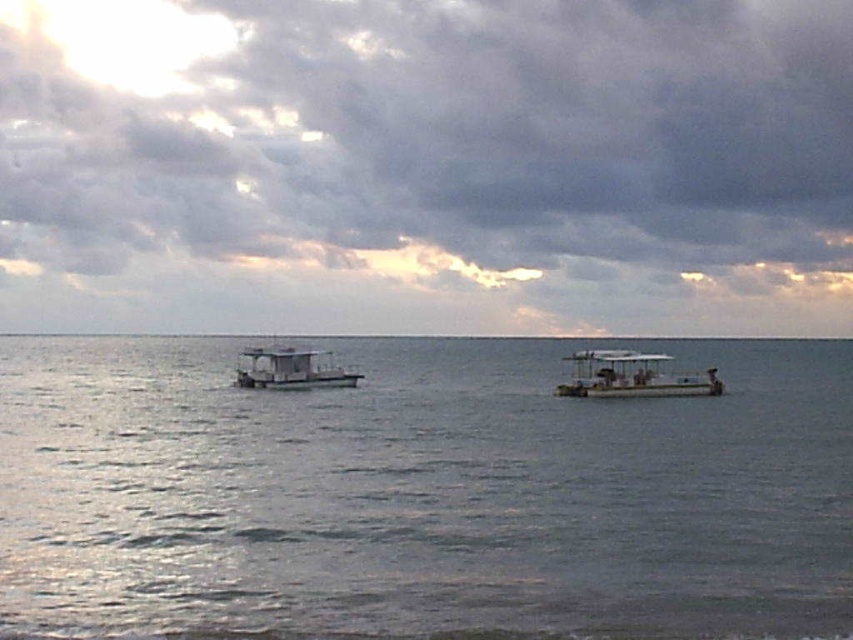
Question: Among these objects, which one is nearest to the camera?

Choices:
 (A) metallic gray boat at right
 (B) cloudy sky at upper center
 (C) white matte boat at center
 (D) clear water at center

Answer: (D)

Question: Does cloudy sky at upper center have a smaller size compared to white matte boat at center?

Choices:
 (A) yes
 (B) no

Answer: (B)

Question: Among these objects, which one is farthest from the camera?

Choices:
 (A) cloudy sky at upper center
 (B) white matte boat at center

Answer: (A)

Question: Can you confirm if clear water at center is bigger than metallic gray boat at right?

Choices:
 (A) no
 (B) yes

Answer: (B)

Question: Does cloudy sky at upper center appear on the right side of metallic gray boat at right?

Choices:
 (A) yes
 (B) no

Answer: (B)

Question: Which object is farther from the camera taking this photo?

Choices:
 (A) metallic gray boat at right
 (B) white matte boat at center
 (C) clear water at center

Answer: (B)